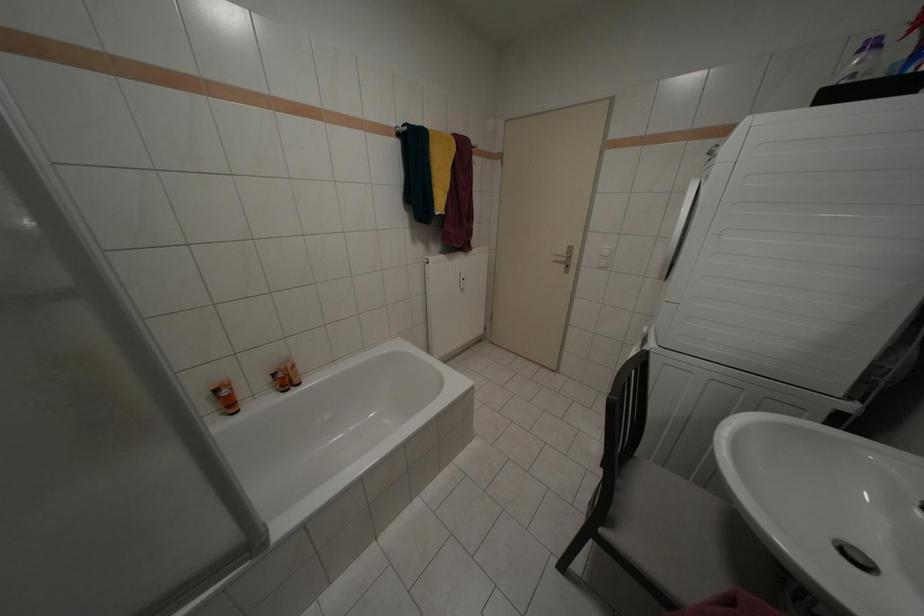
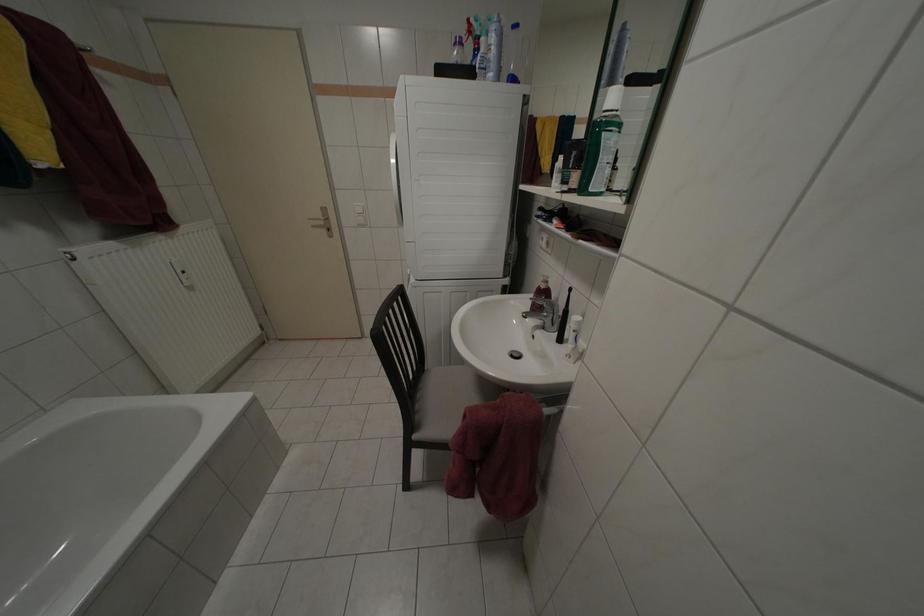
Question: The camera is either moving clockwise (left) or counter-clockwise (right) around the object. The first image is from the beginning of the video and the second image is from the end. Is the camera moving left or right when shooting the video?

Choices:
 (A) Left
 (B) Right

Answer: (A)